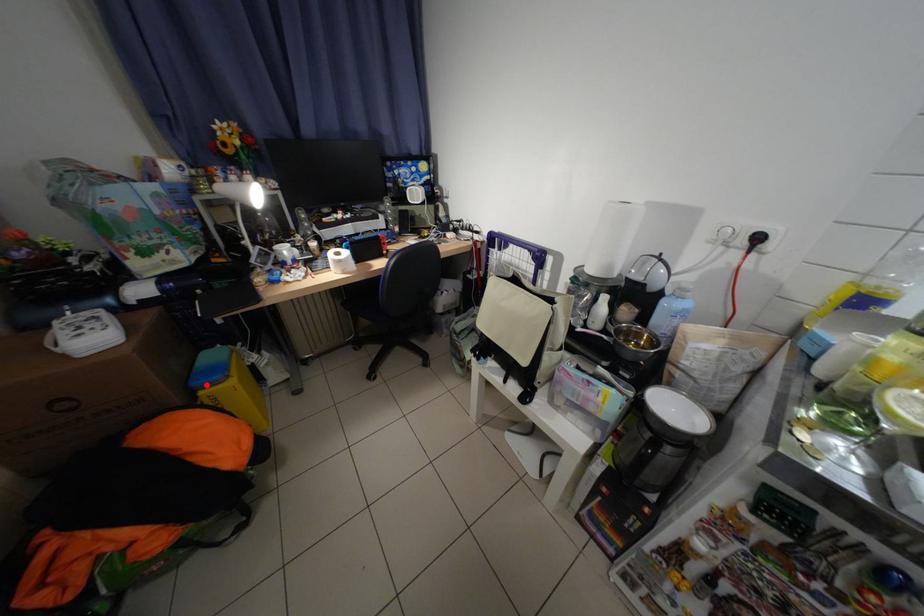
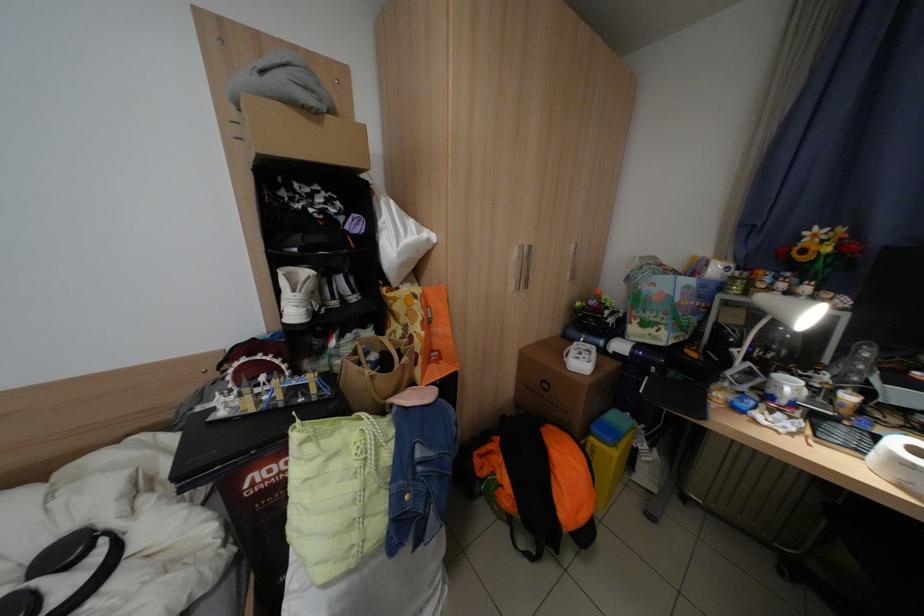
Question: I am providing you with two images of the same scene from different viewpoints. In image1, a red point is highlighted. Considering the same 3D point in image2, which of the following is correct?

Choices:
 (A) It is closer
 (B) It is farther

Answer: (B)